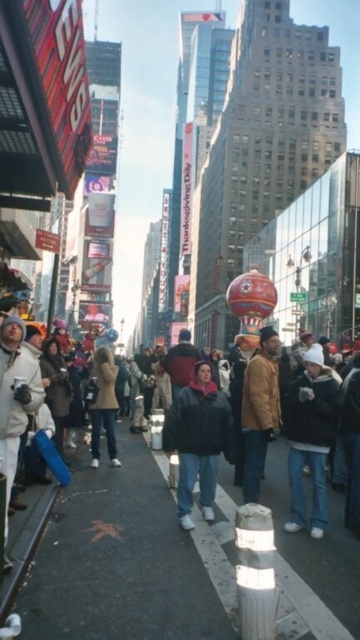
Question: Is dark gray jacket at center wider than white fleece jacket at center?

Choices:
 (A) no
 (B) yes

Answer: (B)

Question: Which object is positioned farthest from the dark brown leather jacket at center?

Choices:
 (A) brown leather jacket at center
 (B) white fleece jacket at center

Answer: (B)

Question: Based on their relative distances, which object is farther from the dark gray jacket at center?

Choices:
 (A) white fleece jacket at center
 (B) concrete sidewalk at center
 (C) black matte jacket at center

Answer: (A)

Question: Can you confirm if concrete sidewalk at center is wider than brown leather jacket at center?

Choices:
 (A) no
 (B) yes

Answer: (B)

Question: Among these points, which one is farthest from the camera?

Choices:
 (A) (262, 433)
 (B) (192, 484)
 (C) (82, 506)

Answer: (A)

Question: Can you confirm if concrete sidewalk at center is thinner than brown leather jacket at center?

Choices:
 (A) yes
 (B) no

Answer: (B)